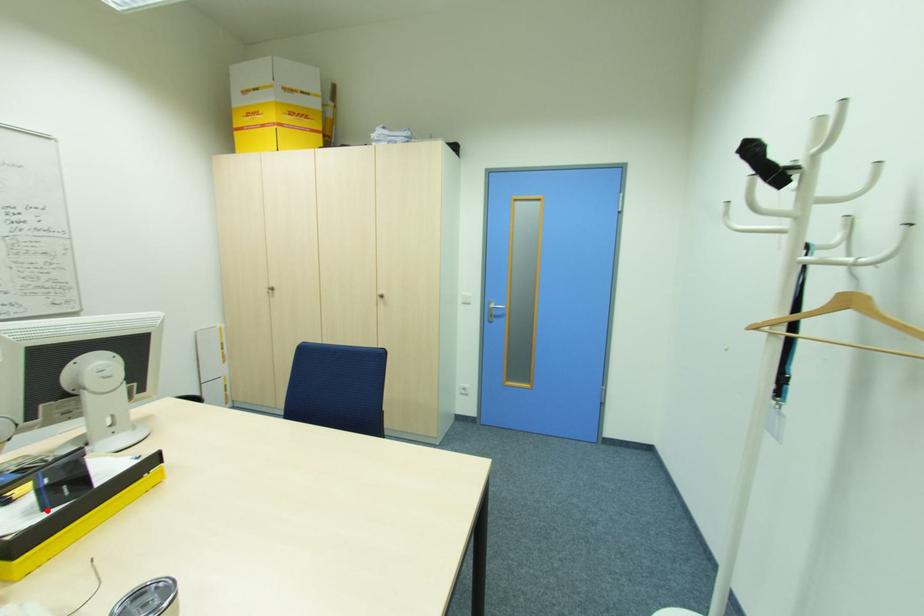
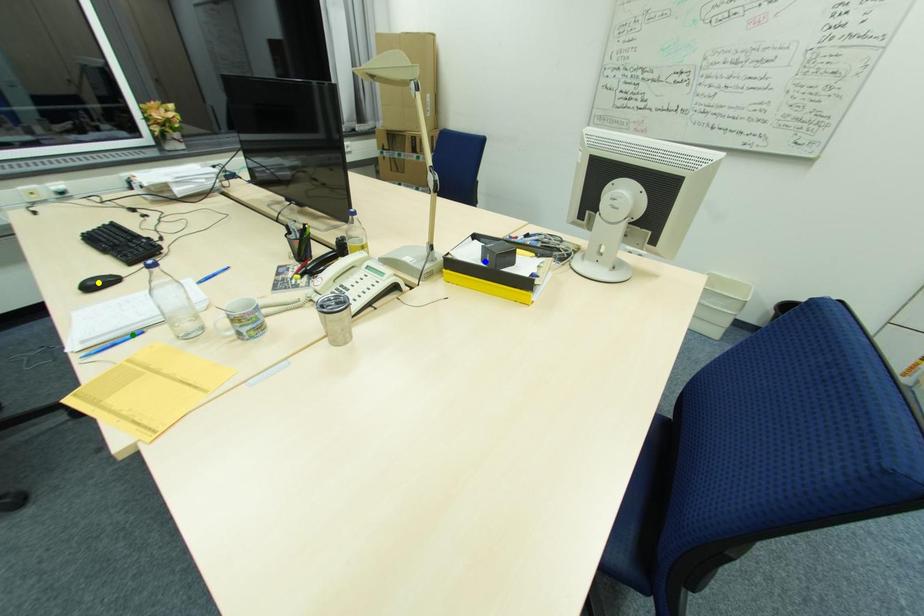
Question: I am providing you with two images of the same scene from different viewpoints. A red point is marked on the first image. You are given multiple points on the second image. Which spot in image 2 lines up with the point in image 1?

Choices:
 (A) green point
 (B) yellow point
 (C) blue point

Answer: (C)